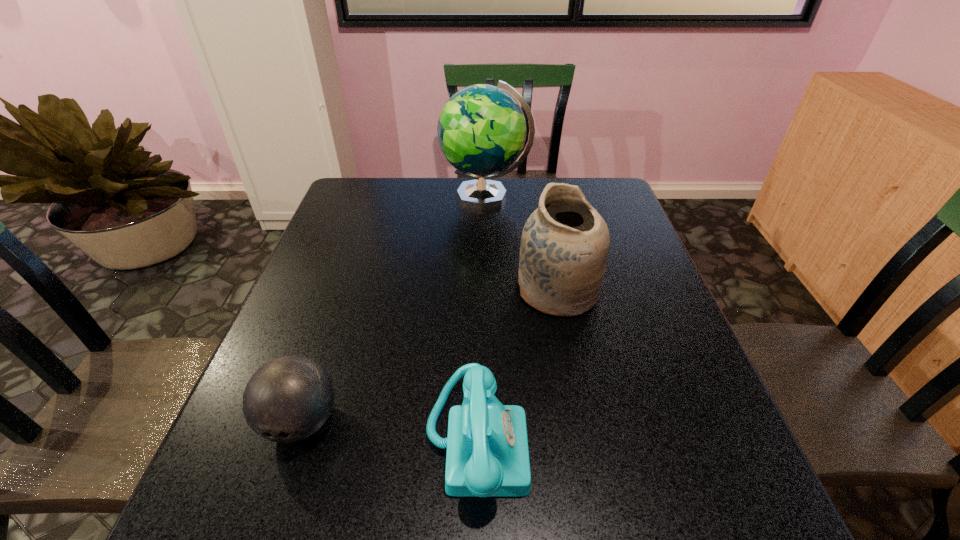
The height and width of the screenshot is (540, 960). I want to click on the tallest object, so [x=481, y=130].

This screenshot has height=540, width=960. What are the coordinates of `globe` in the screenshot? It's located at (481, 130).

Identify the location of the third shortest object. (565, 242).

At what (x,y) coordinates should I click in order to perform the action: click on pottery. Please return your answer as a coordinate pair (x, y). This screenshot has height=540, width=960. Looking at the image, I should click on (565, 242).

This screenshot has width=960, height=540. In order to click on the leftmost object in this screenshot , I will do `click(289, 398)`.

The height and width of the screenshot is (540, 960). I want to click on telephone, so click(487, 455).

Identify the location of vacant space located 0.320m on the front surface of the globe. The image size is (960, 540). (344, 197).

Where is `vacant space located on the front surface of the globe`? vacant space located on the front surface of the globe is located at coordinates (344, 197).

Locate an element on the screen. The image size is (960, 540). free space located on the front surface of the globe is located at coordinates (414, 197).

Locate an element on the screen. Image resolution: width=960 pixels, height=540 pixels. free spot located on the back of the pottery is located at coordinates (544, 224).